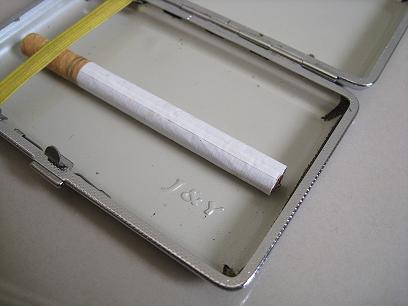
Find the location of a particular element. Image resolution: width=408 pixels, height=306 pixels. hinge is located at coordinates (314, 67), (242, 35), (193, 15).